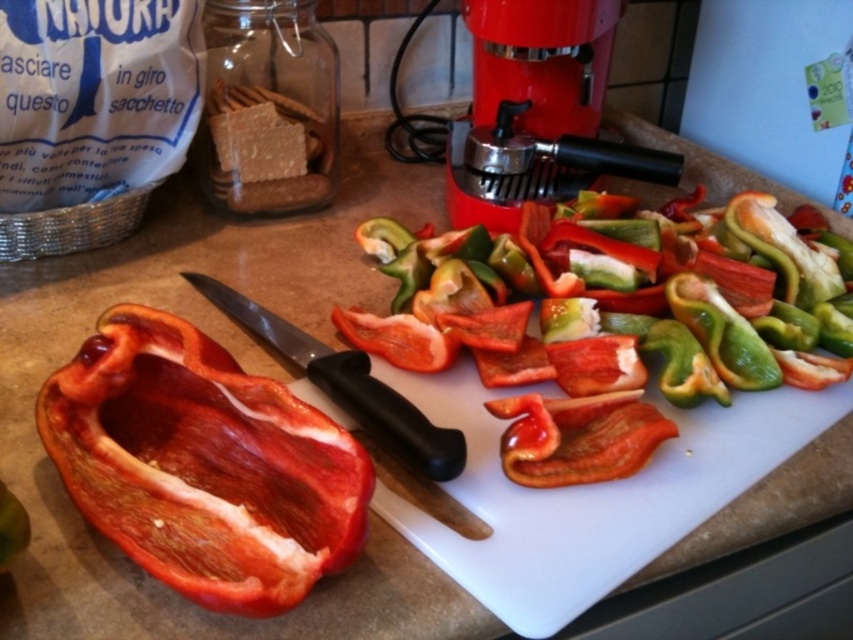
You are a chef preparing ingredients and need to access both the red matte bell pepper at left and the red plastic food processor at upper center. Which object is closer to you when standing in front of the countertop?

The red matte bell pepper at left is closer to you because it is in front of the red plastic food processor at upper center.

You are preparing a meal and need to chop vegetables. You have a red plastic food processor at upper center and a black plastic knife at center. Which tool should you use for precise knife work?

The black plastic knife at center should be used for precise knife work since the red plastic food processor at upper center is located above it and likely designed for blending or processing, not chopping.

You are a chef holding a knife and standing in front of the red matte bell pepper at left. If you want to cut it into small pieces, can you safely reach the pepper without moving your feet?

The red matte bell pepper at left and viewer are 12.64 inches apart from each other. Since the average chef can reach about 12 inches without moving their feet, you might need to take a small step forward to comfortably cut the pepper.